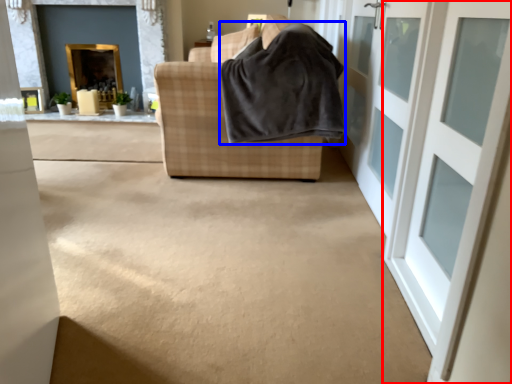
Question: Which object appears closest to the camera in this image, door (highlighted by a red box) or blanket (highlighted by a blue box)?

Choices:
 (A) door
 (B) blanket

Answer: (A)